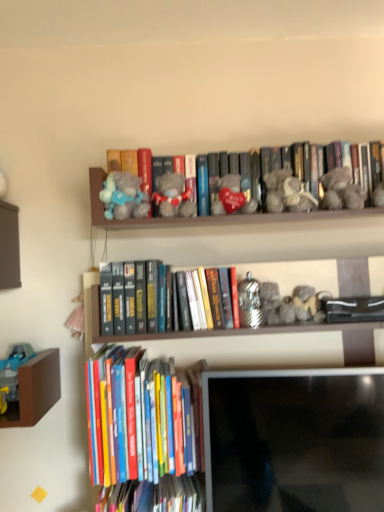
Question: Which direction should I rotate to look at hardcover book at lower center, acting as the 3th book starting from the top, — up or down?

Choices:
 (A) down
 (B) up

Answer: (A)

Question: Is matte black monitor at lower center facing away from fuzzy gray teddy bear at upper right, which is the first toy in right-to-left order?

Choices:
 (A) yes
 (B) no

Answer: (B)

Question: Is matte black monitor at lower center positioned far away from fuzzy gray teddy bear at upper right, the fourth toy when ordered from left to right?

Choices:
 (A) yes
 (B) no

Answer: (B)

Question: Does matte black monitor at lower center contain fuzzy gray teddy bear at upper right, the fourth toy when ordered from left to right?

Choices:
 (A) no
 (B) yes

Answer: (A)

Question: Does matte black monitor at lower center have a lesser height compared to fuzzy gray teddy bear at upper right, the fourth toy when ordered from left to right?

Choices:
 (A) yes
 (B) no

Answer: (B)

Question: Does matte black monitor at lower center have a larger size compared to fuzzy gray teddy bear at upper right, which is the first toy in right-to-left order?

Choices:
 (A) no
 (B) yes

Answer: (B)

Question: From a real-world perspective, is matte black monitor at lower center below fuzzy gray teddy bear at upper right, the fourth toy when ordered from left to right?

Choices:
 (A) no
 (B) yes

Answer: (B)

Question: Is matte black monitor at lower center oriented towards gray plush bear at center, which is the 1th book in top-to-bottom order?

Choices:
 (A) yes
 (B) no

Answer: (B)

Question: Is matte black monitor at lower center bigger than gray plush bear at center, the third book ordered from the bottom?

Choices:
 (A) yes
 (B) no

Answer: (A)

Question: Does matte black monitor at lower center come in front of gray plush bear at center, which is the 1th book in top-to-bottom order?

Choices:
 (A) yes
 (B) no

Answer: (A)

Question: Is matte black monitor at lower center to the right of gray plush bear at center, the third book ordered from the bottom, from the viewer's perspective?

Choices:
 (A) yes
 (B) no

Answer: (B)

Question: From the image's perspective, does matte black monitor at lower center appear higher than gray plush bear at center, the third book ordered from the bottom?

Choices:
 (A) no
 (B) yes

Answer: (A)

Question: From the image's perspective, does matte black monitor at lower center appear lower than gray plush bear at center, the third book ordered from the bottom?

Choices:
 (A) no
 (B) yes

Answer: (B)

Question: Is hardcover books at lower left, the second book viewed from the top, looking in the opposite direction of fuzzy gray teddy bear at upper right, which is the first toy in right-to-left order?

Choices:
 (A) no
 (B) yes

Answer: (A)